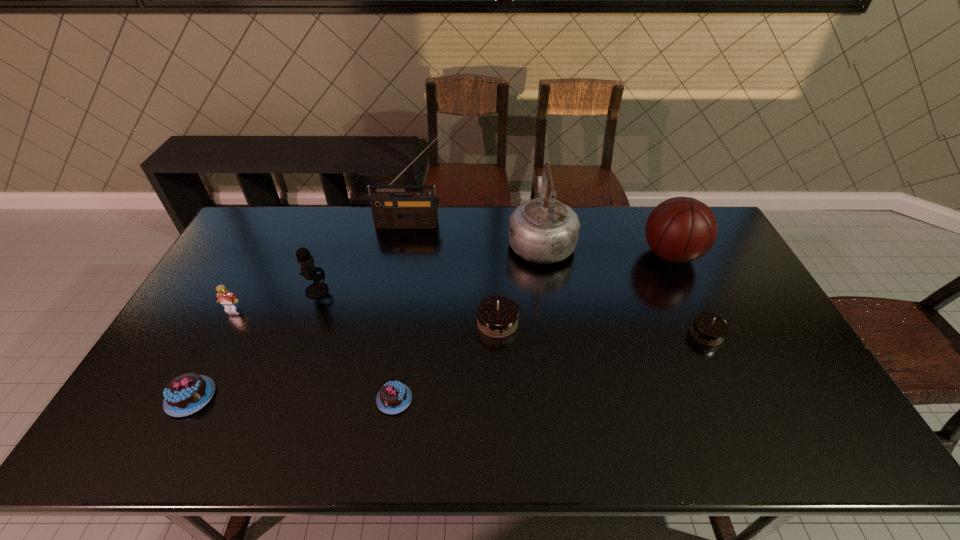
Locate an element on the screen. free location at the far edge is located at coordinates (504, 224).

This screenshot has height=540, width=960. In the image, there is a desktop. Find the location of `vacant space at the near edge`. vacant space at the near edge is located at coordinates (708, 431).

What are the coordinates of `vacant space at the left edge of the desktop` in the screenshot? It's located at (194, 339).

In the image, there is a desktop. Find the location of `vacant space at the right edge`. vacant space at the right edge is located at coordinates (732, 266).

The width and height of the screenshot is (960, 540). What are the coordinates of `free space between the shortest object and the seventh shortest object` in the screenshot? It's located at (533, 327).

You are a GUI agent. You are given a task and a screenshot of the screen. Output one action in this format:
    pyautogui.click(x=<x>, y=<y>)
    Task: Click on the free space between the second chocolate cake from left to right and the right chocolate chocolate cake
    
    Given the screenshot: What is the action you would take?
    pyautogui.click(x=550, y=367)

Find the location of a particular element. This screenshot has height=540, width=960. vacant space in between the kettle and the bigger chocolate chocolate cake is located at coordinates (519, 282).

This screenshot has height=540, width=960. In order to click on vacant area between the tallest chocolate cake and the eighth shortest object in this screenshot , I will do `click(519, 282)`.

The width and height of the screenshot is (960, 540). Identify the location of free space between the eighth shortest object and the left pink chocolate cake. (366, 319).

Where is `vacant region between the fourth farthest object and the Lego`? This screenshot has height=540, width=960. vacant region between the fourth farthest object and the Lego is located at coordinates (275, 300).